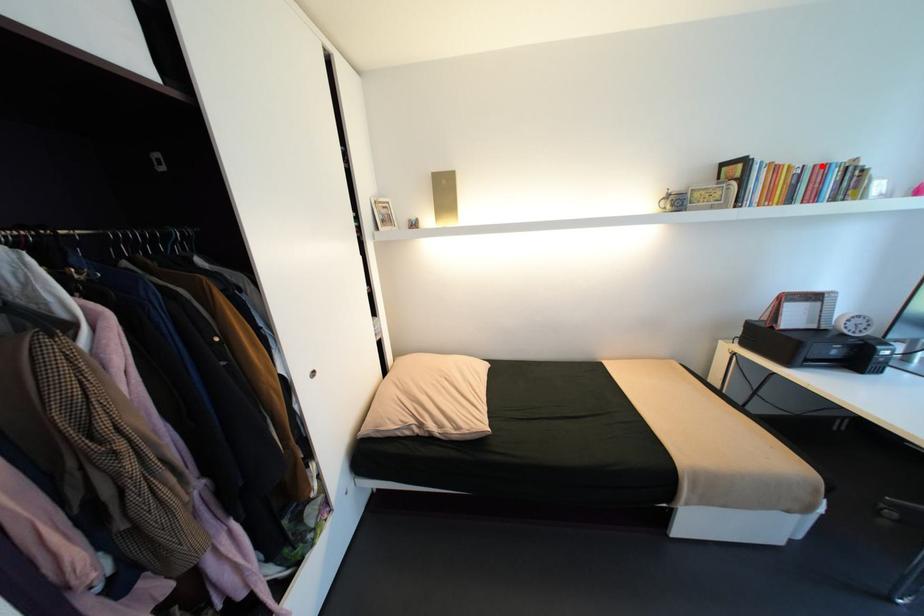
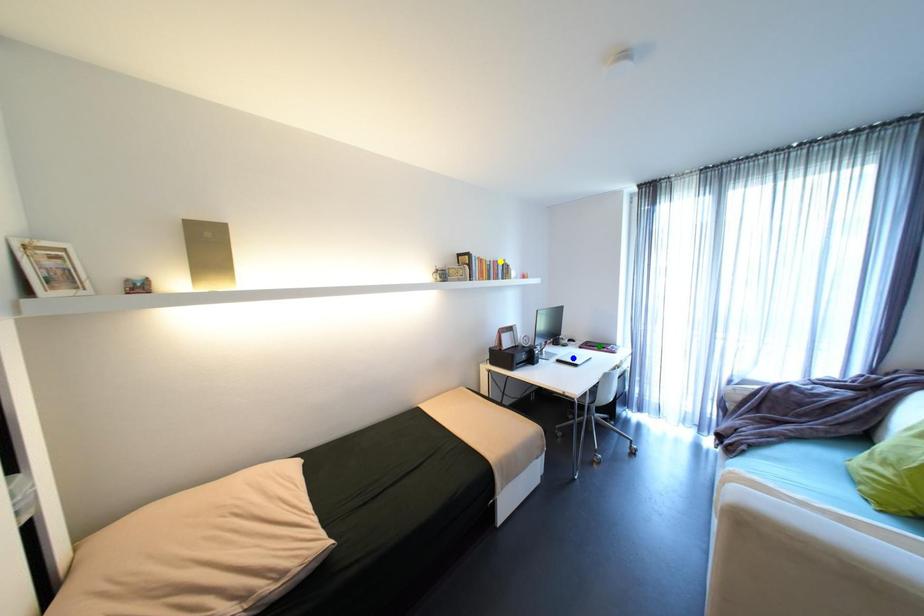
Question: I am providing you with two images of the same scene from different viewpoints. A red point is marked on the first image. You are given multiple points on the second image. Can you choose the point in image 2 that corresponds to the point in image 1?

Choices:
 (A) green point
 (B) blue point
 (C) yellow point

Answer: (C)